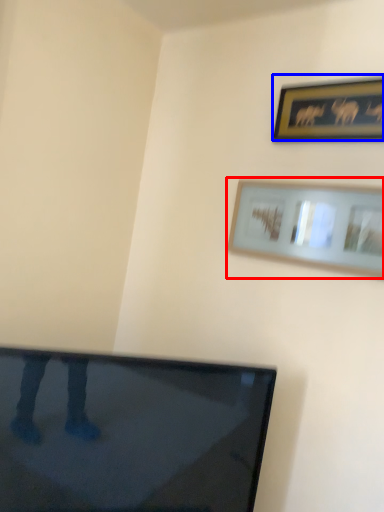
Question: Which of the following is the farthest to the observer, picture frame (highlighted by a red box) or picture frame (highlighted by a blue box)?

Choices:
 (A) picture frame
 (B) picture frame

Answer: (B)